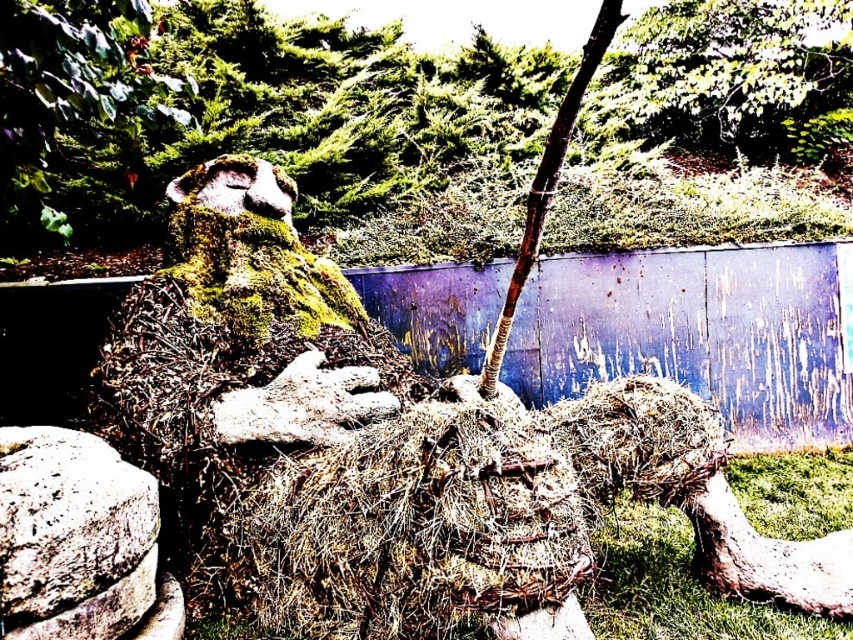
Is dry straw at center taller than gray rough stone at lower left?

No, dry straw at center is not taller than gray rough stone at lower left.

The image size is (853, 640). What do you see at coordinates (674, 586) in the screenshot?
I see `dry straw at center` at bounding box center [674, 586].

Locate an element on the screen. dry straw at center is located at coordinates (674, 586).

Does point (115, 157) come behind point (77, 448)?

Yes, point (115, 157) is farther from viewer.

Where is `green mossy tree at upper left`? This screenshot has width=853, height=640. green mossy tree at upper left is located at coordinates (244, 112).

This screenshot has width=853, height=640. I want to click on green mossy tree at upper left, so click(x=244, y=112).

Which is behind, point (264, 124) or point (657, 552)?

Point (264, 124)

Is green mossy tree at upper left closer to camera compared to dry straw at center?

No, it is not.

The height and width of the screenshot is (640, 853). Identify the location of green mossy tree at upper left. (244, 112).